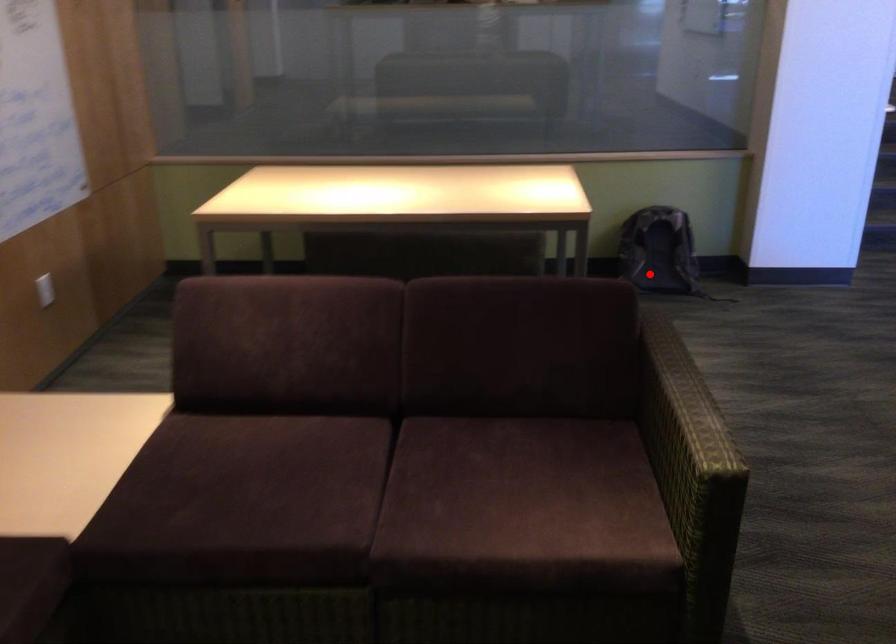
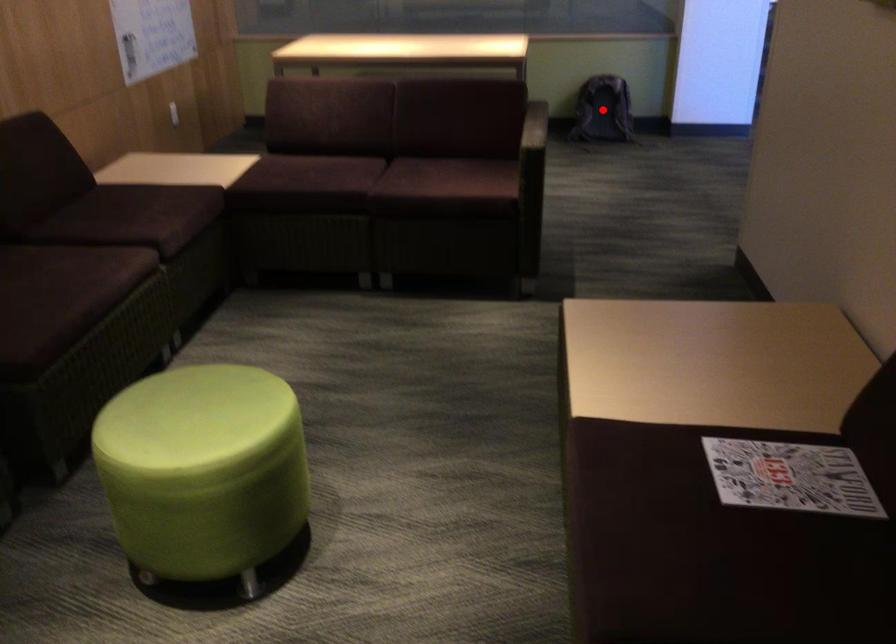
I am providing you with two images of the same scene from different viewpoints. A red point is marked on the first image and another point is marked on the second image. Is the marked point in image1 the same physical position as the marked point in image2?

Yes